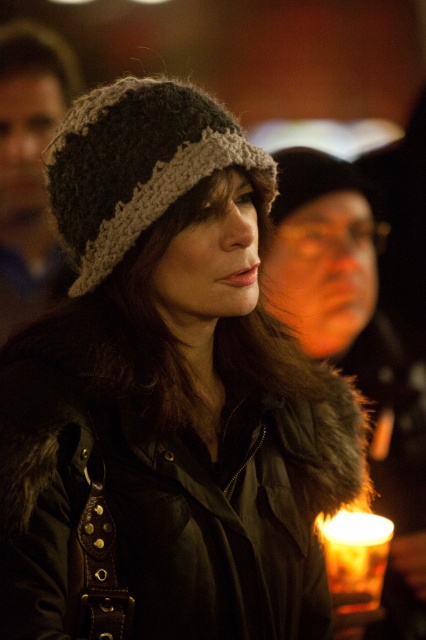
Is knitted woolen hat at center above translucent glass candle at lower right?

Indeed, knitted woolen hat at center is positioned over translucent glass candle at lower right.

Consider the image. Can you confirm if knitted woolen hat at center is positioned below translucent glass candle at lower right?

No.

Which is behind, point (71, 234) or point (351, 525)?

The point (351, 525) is behind.

At what (x,y) coordinates should I click in order to perform the action: click on knitted woolen hat at center. Please return your answer as a coordinate pair (x, y). Image resolution: width=426 pixels, height=640 pixels. Looking at the image, I should click on (135, 164).

Is translucent glass candle at lower right behind fuzzy knit hat at center?

No, translucent glass candle at lower right is in front of fuzzy knit hat at center.

Is translucent glass candle at lower right to the left of fuzzy knit hat at center from the viewer's perspective?

Correct, you'll find translucent glass candle at lower right to the left of fuzzy knit hat at center.

Is point (377, 548) closer to viewer compared to point (356, 188)?

Yes, point (377, 548) is in front of point (356, 188).

Image resolution: width=426 pixels, height=640 pixels. I want to click on translucent glass candle at lower right, so click(356, 557).

Looking at this image, is knitted woolen hat at center above fuzzy knit hat at center?

Incorrect, knitted woolen hat at center is not positioned above fuzzy knit hat at center.

Can you confirm if knitted woolen hat at center is positioned below fuzzy knit hat at center?

Correct, knitted woolen hat at center is located below fuzzy knit hat at center.

Which is in front, point (178, 125) or point (271, 205)?

Positioned in front is point (178, 125).

Where is `knitted woolen hat at center`? The width and height of the screenshot is (426, 640). knitted woolen hat at center is located at coordinates (135, 164).